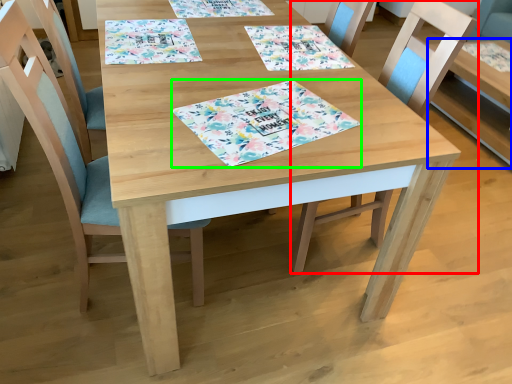
Question: Which object is the farthest from chair (highlighted by a red box)? Choose among these: table (highlighted by a blue box) or place mat (highlighted by a green box).

Choices:
 (A) table
 (B) place mat

Answer: (A)